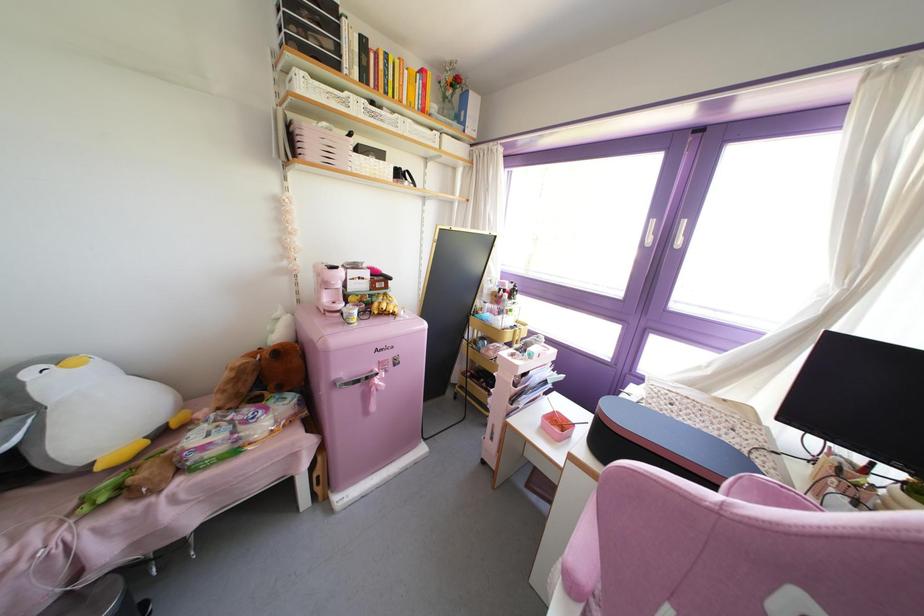
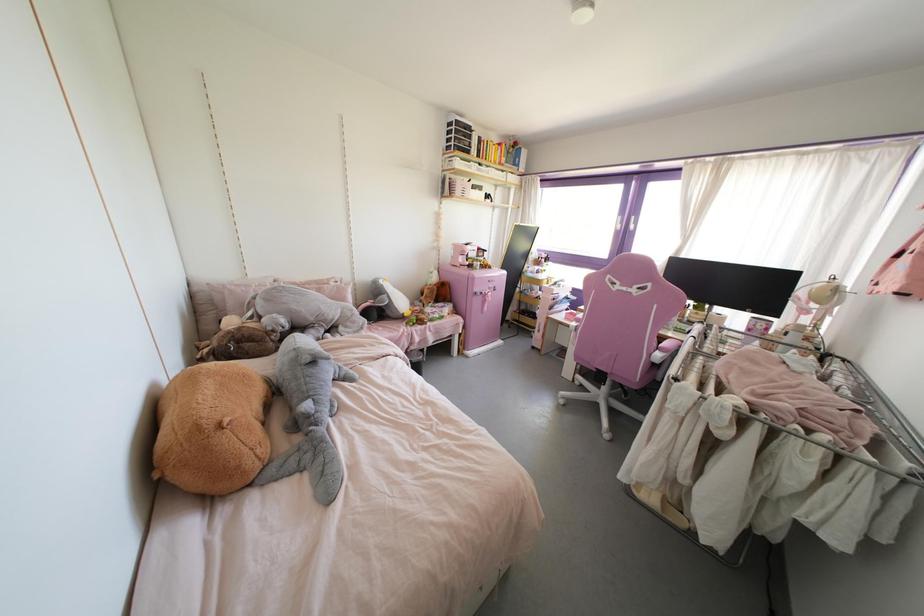
Looking at this image, in a continuous first-person perspective shot, in which direction is the camera moving?

The cameraman walked toward left, backward.